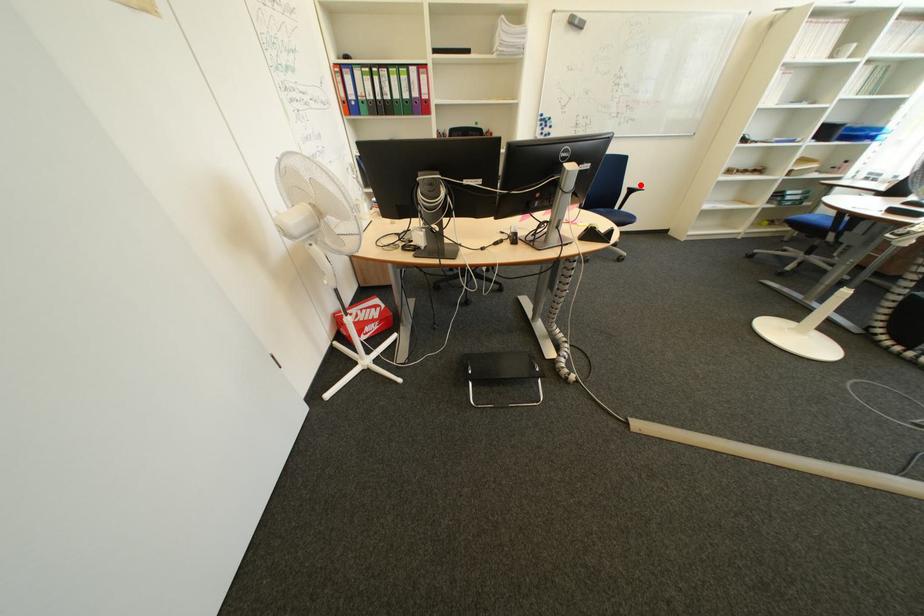
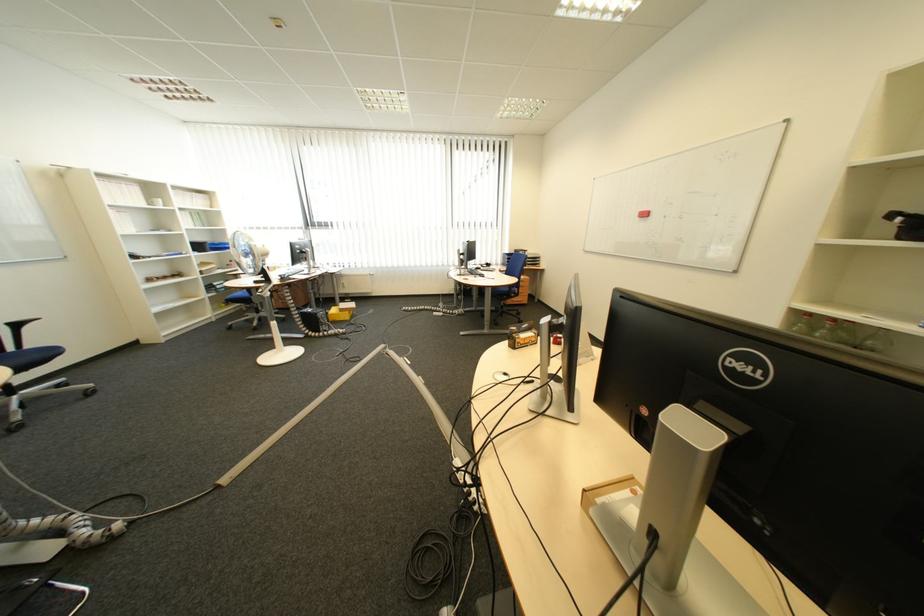
Question: I am providing you with two images of the same scene from different viewpoints. Given a red point in image1, look at the same physical point in image2. Is it:

Choices:
 (A) Closer to the viewpoint
 (B) Farther from the viewpoint

Answer: (B)